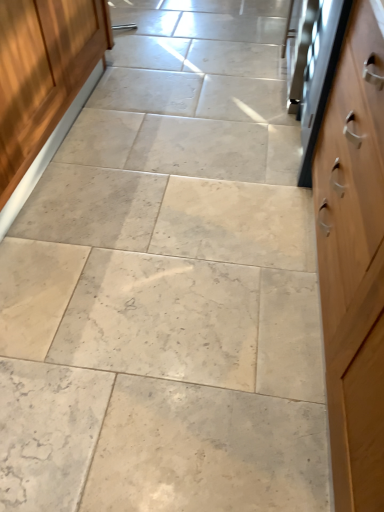
Question: From the image's perspective, is satin silver oven at right below wooden cabinet at left?

Choices:
 (A) yes
 (B) no

Answer: (B)

Question: Could you tell me if satin silver oven at right is turned towards wooden cabinet at left?

Choices:
 (A) yes
 (B) no

Answer: (A)

Question: Is satin silver oven at right further to the viewer compared to wooden cabinet at left?

Choices:
 (A) no
 (B) yes

Answer: (B)

Question: From a real-world perspective, is satin silver oven at right physically above wooden cabinet at left?

Choices:
 (A) no
 (B) yes

Answer: (B)

Question: Would you say satin silver oven at right is a long distance from wooden cabinet at left?

Choices:
 (A) yes
 (B) no

Answer: (A)

Question: Is satin silver oven at right positioned with its back to wooden cabinet at left?

Choices:
 (A) no
 (B) yes

Answer: (A)

Question: Is the position of wooden cabinet at left less distant than that of satin silver oven at right?

Choices:
 (A) no
 (B) yes

Answer: (B)

Question: Does wooden cabinet at left appear on the left side of satin silver oven at right?

Choices:
 (A) yes
 (B) no

Answer: (A)

Question: Does wooden cabinet at left have a smaller size compared to satin silver oven at right?

Choices:
 (A) yes
 (B) no

Answer: (B)

Question: From a real-world perspective, is wooden cabinet at left located higher than satin silver oven at right?

Choices:
 (A) yes
 (B) no

Answer: (B)

Question: From the image's perspective, is wooden cabinet at left below satin silver oven at right?

Choices:
 (A) yes
 (B) no

Answer: (A)

Question: Can you confirm if wooden cabinet at left is shorter than satin silver oven at right?

Choices:
 (A) no
 (B) yes

Answer: (B)

Question: Considering the relative positions of wooden cabinet at left and satin silver oven at right in the image provided, is wooden cabinet at left to the left or to the right of satin silver oven at right?

Choices:
 (A) left
 (B) right

Answer: (A)